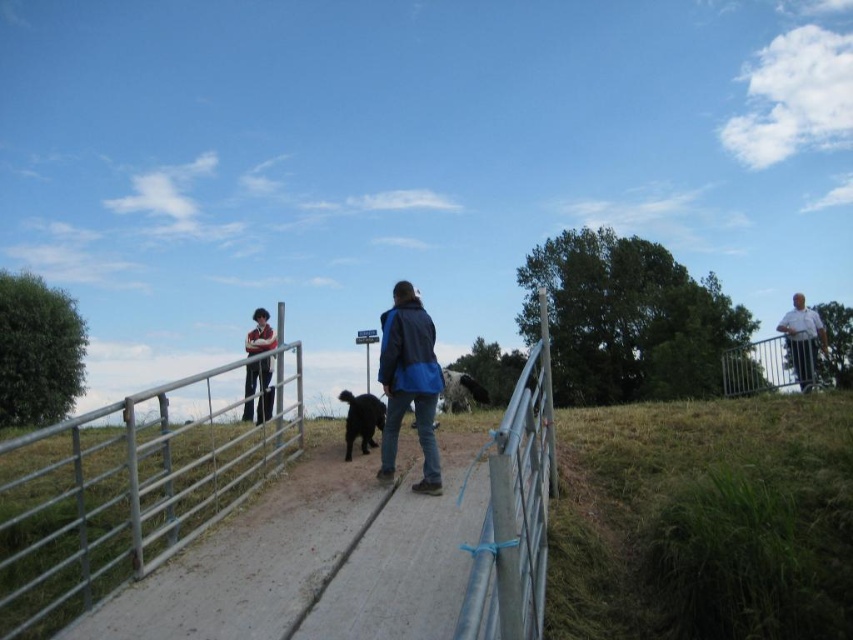
You are a photographer positioned at the center of the image. You want to capture a photo that includes both the white cotton shirt at right and the black fur dog at center. Considering the distance between them, will you need to adjust your camera zoom to include both subjects in the frame?

The distance between the white cotton shirt at right and the black fur dog at center is 32.84 feet. To include both in the frame, you would need to adjust your camera zoom to a wider angle to accommodate the space between them.

You are standing at the point labeled as point (804,339) in the image. What object is located exactly at that point?

The white cotton shirt at right is located exactly at point (804,339).

You are a photographer trying to capture both the white cotton shirt at right and the matte red shirt at left in a single frame. Considering their sizes, which shirt should you focus on to ensure both are clearly visible in your photo?

The white cotton shirt at right is larger than the matte red shirt at left, so focusing on the white cotton shirt at right would help ensure both are visible as it takes up more space in the frame.